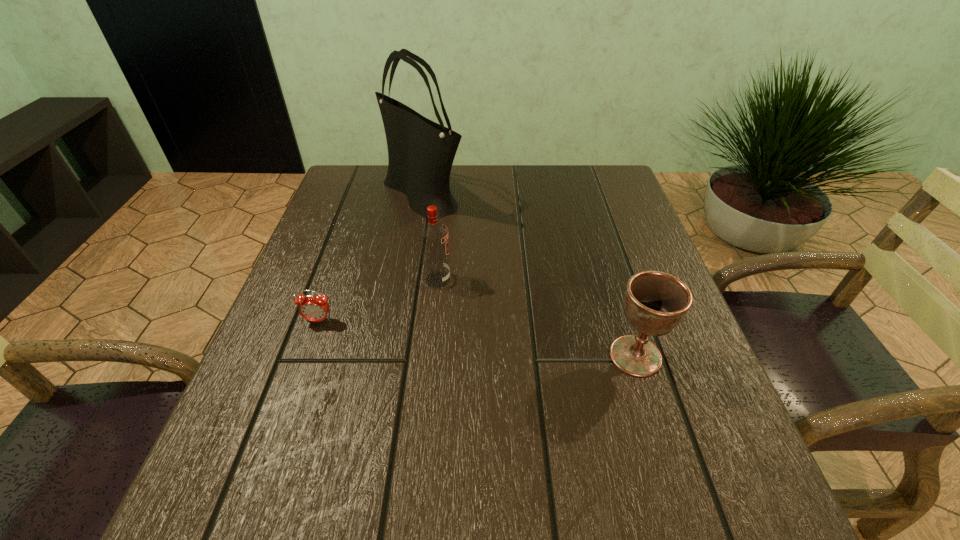
Locate an element on the screen. This screenshot has height=540, width=960. free space located on the face of the shortest object is located at coordinates [256, 497].

You are a GUI agent. You are given a task and a screenshot of the screen. Output one action in this format:
    pyautogui.click(x=<x>, y=<y>)
    Task: Click on the object that is at the far edge
    This screenshot has width=960, height=540.
    Given the screenshot: What is the action you would take?
    [x=421, y=152]

This screenshot has width=960, height=540. What are the coordinates of `shoulder bag positioned at the left edge` in the screenshot? It's located at (421, 152).

Locate an element on the screen. The height and width of the screenshot is (540, 960). alarm clock positioned at the left edge is located at coordinates (313, 308).

The height and width of the screenshot is (540, 960). I want to click on object at the right edge, so click(x=655, y=302).

The width and height of the screenshot is (960, 540). Find the location of `object situated at the far left corner`. object situated at the far left corner is located at coordinates (421, 152).

The image size is (960, 540). In the image, there is a desktop. What are the coordinates of `free space at the far edge` in the screenshot? It's located at (501, 204).

The image size is (960, 540). I want to click on free space at the near edge of the desktop, so click(x=638, y=526).

This screenshot has width=960, height=540. Find the location of `vacant space at the left edge of the desktop`. vacant space at the left edge of the desktop is located at coordinates (300, 437).

In the image, there is a desktop. Where is `vacant space at the right edge`? vacant space at the right edge is located at coordinates (633, 445).